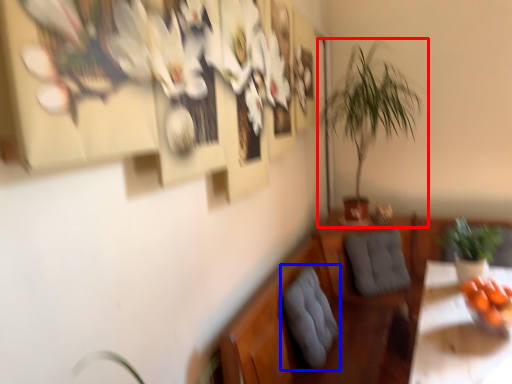
Question: Which of the following is the farthest to the observer, houseplant (highlighted by a red box) or swivel chair (highlighted by a blue box)?

Choices:
 (A) houseplant
 (B) swivel chair

Answer: (A)